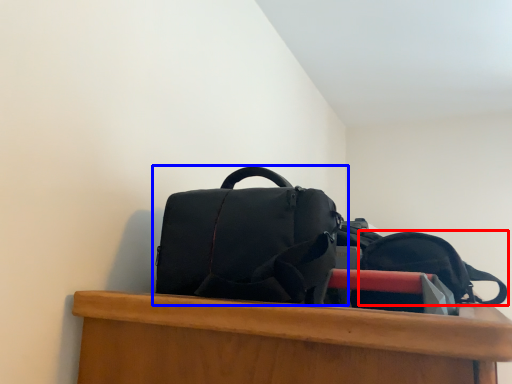
Question: Which object is further to the camera taking this photo, backpack (highlighted by a red box) or backpack (highlighted by a blue box)?

Choices:
 (A) backpack
 (B) backpack

Answer: (A)